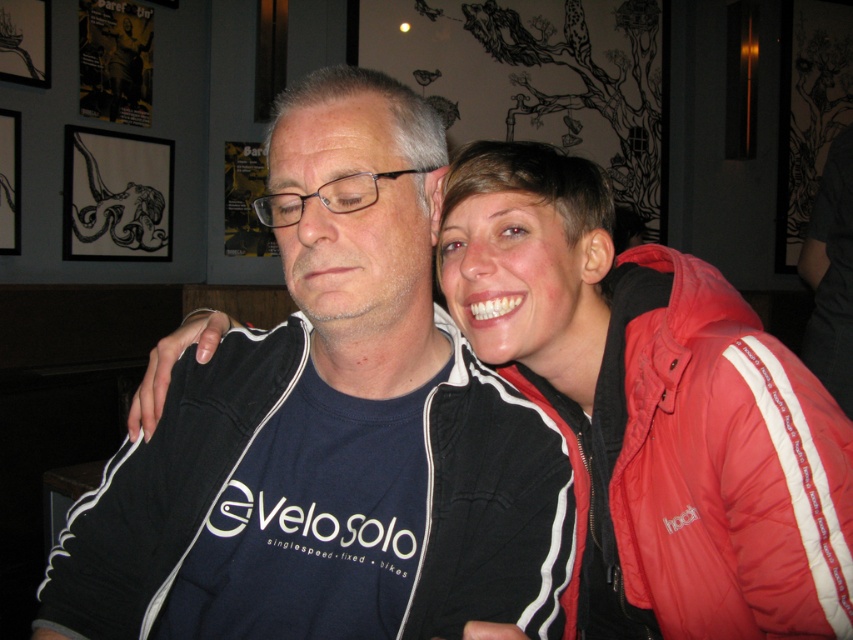
Question: Among these points, which one is farthest from the camera?

Choices:
 (A) (442, 573)
 (B) (757, 464)

Answer: (B)

Question: Which of the following is the farthest from the observer?

Choices:
 (A) black matte jacket at center
 (B) red puffy jacket at right

Answer: (B)

Question: Does black matte jacket at center have a greater width compared to red puffy jacket at right?

Choices:
 (A) no
 (B) yes

Answer: (B)

Question: Can you confirm if black matte jacket at center is bigger than red puffy jacket at right?

Choices:
 (A) yes
 (B) no

Answer: (A)

Question: Is black matte jacket at center wider than red puffy jacket at right?

Choices:
 (A) no
 (B) yes

Answer: (B)

Question: Which point appears closest to the camera in this image?

Choices:
 (A) [753, 378]
 (B) [265, 525]

Answer: (B)